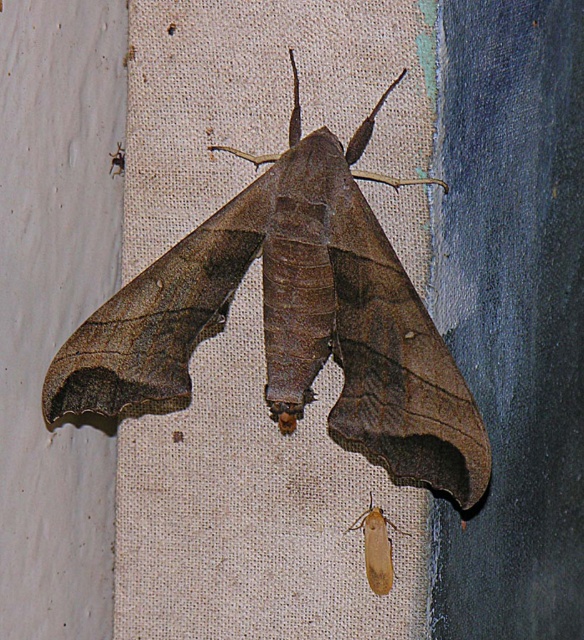
Does brown matte moth at center lie in front of light brown fuzzy moth at lower right?

Yes.

Is point (221, 234) farther from viewer compared to point (384, 577)?

No.

Between point (130, 396) and point (388, 580), which one is positioned in front?

Point (130, 396)

At what (x,y) coordinates should I click in order to perform the action: click on brown matte moth at center. Please return your answer as a coordinate pair (x, y). The image size is (584, 640). Looking at the image, I should click on (292, 321).